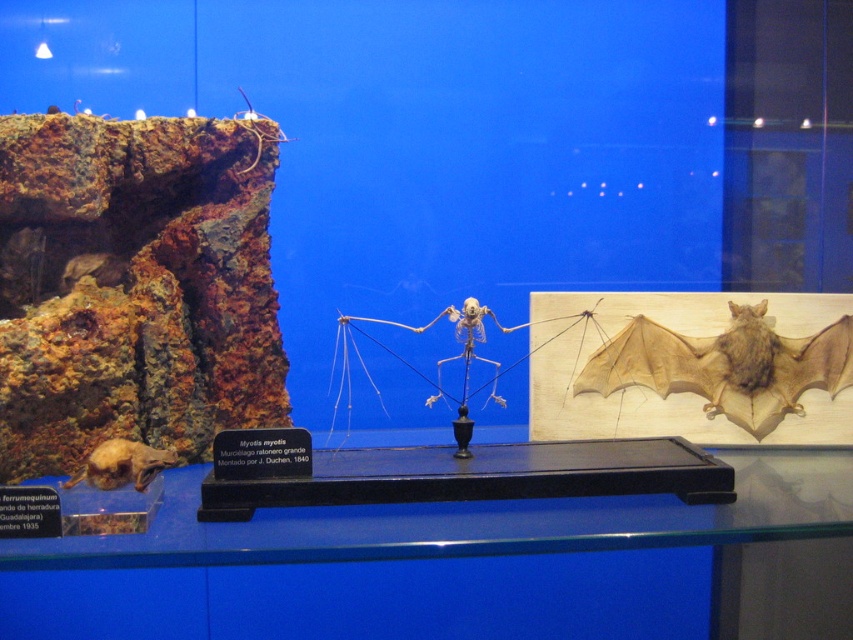
You are a visitor at the museum and want to take a photo of both the brown leather bat at center and the brown furry bat at lower left. Which one should you focus on first if you want to capture both in the same frame without moving your camera?

The brown leather bat at center is above the brown furry bat at lower left, so you should focus on the brown leather bat at center first to ensure both are in the frame.

You are a museum visitor observing the two bats in the scene. The brown leather bat at center and the brown furry bat at lower left. Which bat is taller?

The brown leather bat at center is taller than the brown furry bat at lower left.